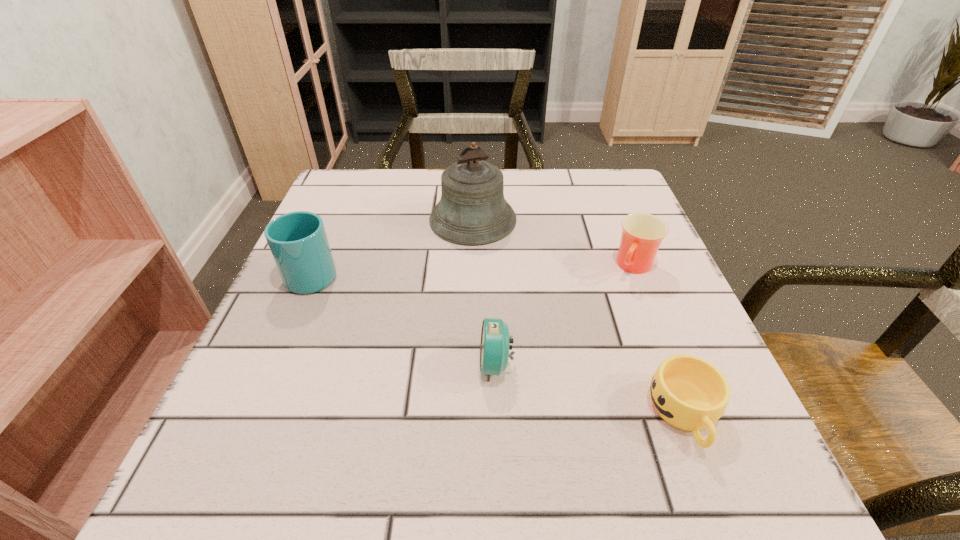
Locate an element on the screen. The width and height of the screenshot is (960, 540). free space between the alarm clock and the second tallest cup is located at coordinates (565, 315).

The image size is (960, 540). I want to click on free space between the nearest cup and the second tallest cup, so click(x=660, y=340).

The image size is (960, 540). Find the location of `free point between the tallest cup and the tallest object`. free point between the tallest cup and the tallest object is located at coordinates (394, 246).

Identify the location of vacant area between the shortest cup and the bell. The image size is (960, 540). (579, 317).

Where is `free space between the second tallest object and the second tallest cup`? free space between the second tallest object and the second tallest cup is located at coordinates (474, 269).

Select which object is the second closest to the nearest cup. Please provide its 2D coordinates. Your answer should be formatted as a tuple, i.e. [(x, y)], where the tuple contains the x and y coordinates of a point satisfying the conditions above.

[(642, 233)]

Locate an element on the screen. This screenshot has height=540, width=960. object that stands as the second closest to the second shortest cup is located at coordinates (688, 392).

I want to click on the second closest cup to the second shortest cup, so click(x=298, y=242).

Identify the location of the second closest cup to the second tallest cup. (298, 242).

This screenshot has height=540, width=960. I want to click on vacant space that satisfies the following two spatial constraints: 1. on the back side of the shortest cup; 2. on the front-facing side of the alarm clock, so click(x=665, y=364).